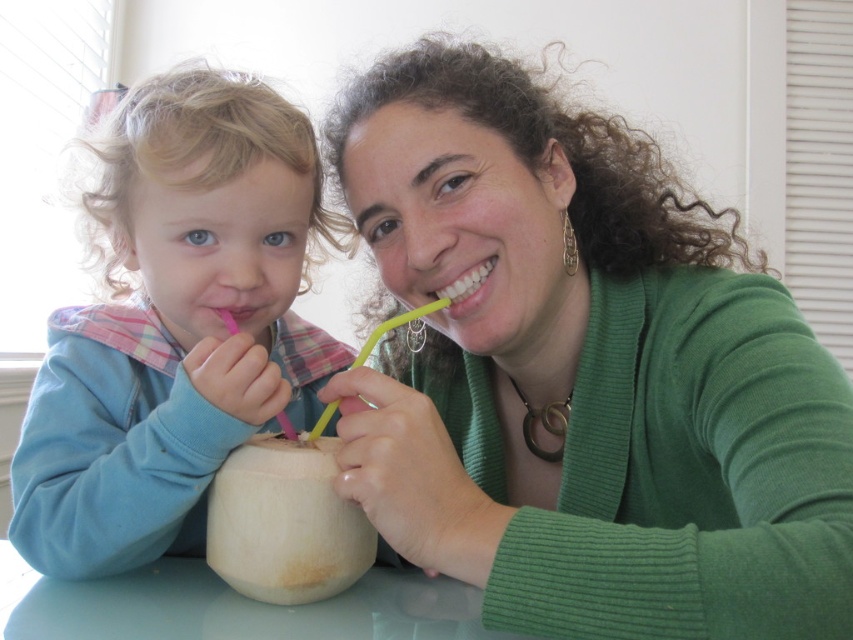
Question: Based on their relative distances, which object is farther from the glossy plastic table at center?

Choices:
 (A) blue fleece jacket at left
 (B) white glossy teeth at center
 (C) yellow plastic straw at center

Answer: (B)

Question: Is green ribbed sweater at center to the left of white glossy teeth at center from the viewer's perspective?

Choices:
 (A) no
 (B) yes

Answer: (A)

Question: Is glossy plastic table at center to the right of yellow plastic straw at center from the viewer's perspective?

Choices:
 (A) yes
 (B) no

Answer: (B)

Question: Based on their relative distances, which object is farther from the glossy plastic table at center?

Choices:
 (A) pink plastic straw at left
 (B) green ribbed sweater at center

Answer: (B)

Question: Which of the following is the farthest from the observer?

Choices:
 (A) (440, 604)
 (B) (293, 435)

Answer: (A)

Question: Is blue fleece jacket at left bigger than white matte coconut at center?

Choices:
 (A) yes
 (B) no

Answer: (A)